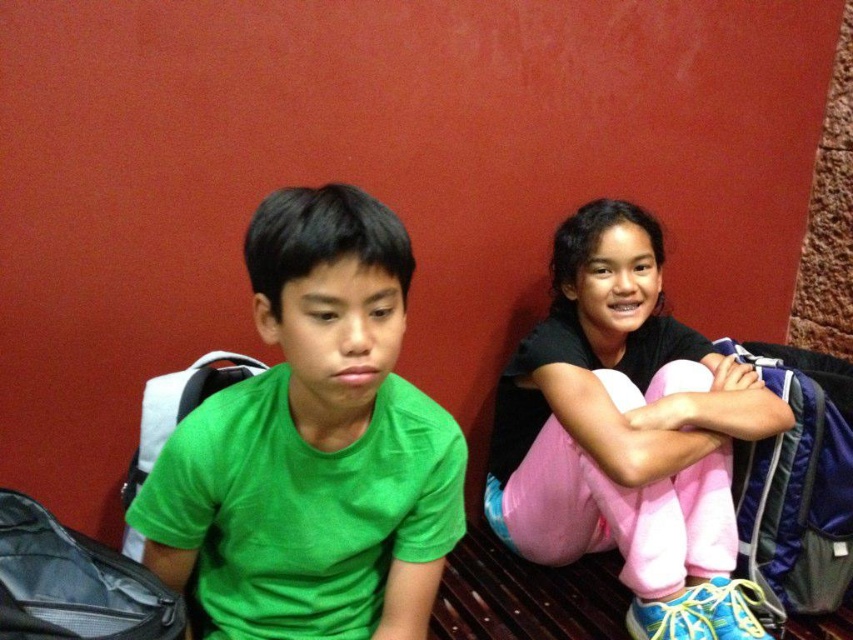
Question: Is green matte shirt at center further to camera compared to pink fleece pants at center?

Choices:
 (A) yes
 (B) no

Answer: (B)

Question: Does green matte shirt at center appear on the left side of pink fleece pants at center?

Choices:
 (A) yes
 (B) no

Answer: (A)

Question: Among these objects, which one is farthest from the camera?

Choices:
 (A) green matte shirt at center
 (B) pink fleece pants at center

Answer: (B)

Question: Which of the following is the closest to the observer?

Choices:
 (A) green matte shirt at center
 (B) pink fleece pants at center

Answer: (A)

Question: Is green matte shirt at center bigger than pink fleece pants at center?

Choices:
 (A) no
 (B) yes

Answer: (A)